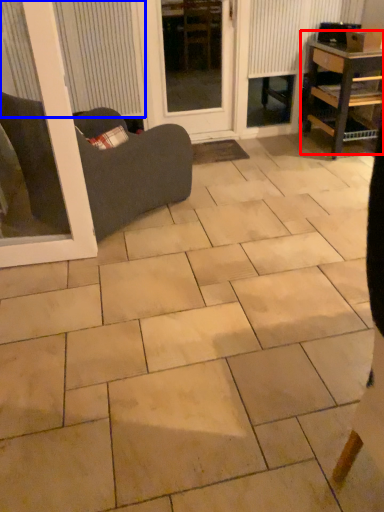
Question: Which of the following is the closest to the observer, table (highlighted by a red box) or blind (highlighted by a blue box)?

Choices:
 (A) table
 (B) blind

Answer: (B)